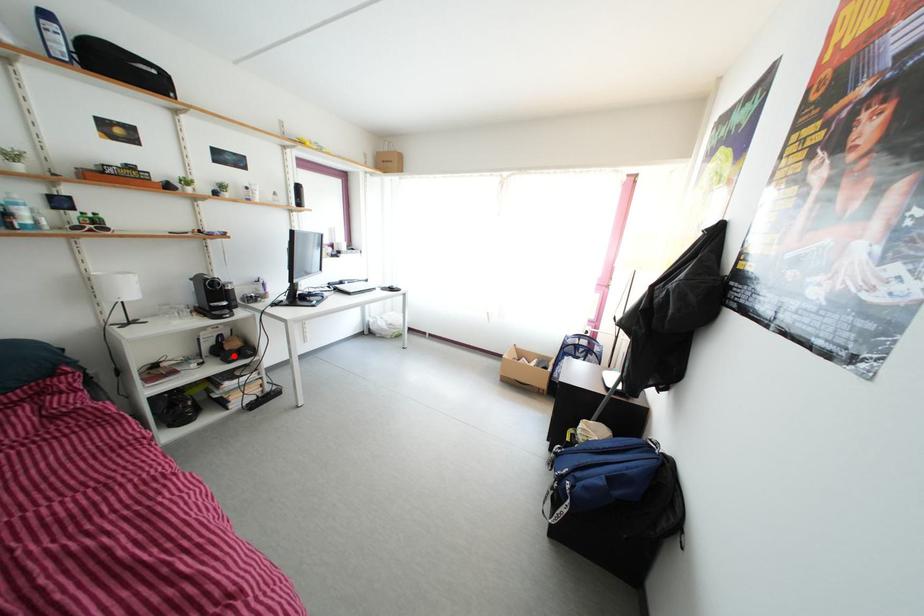
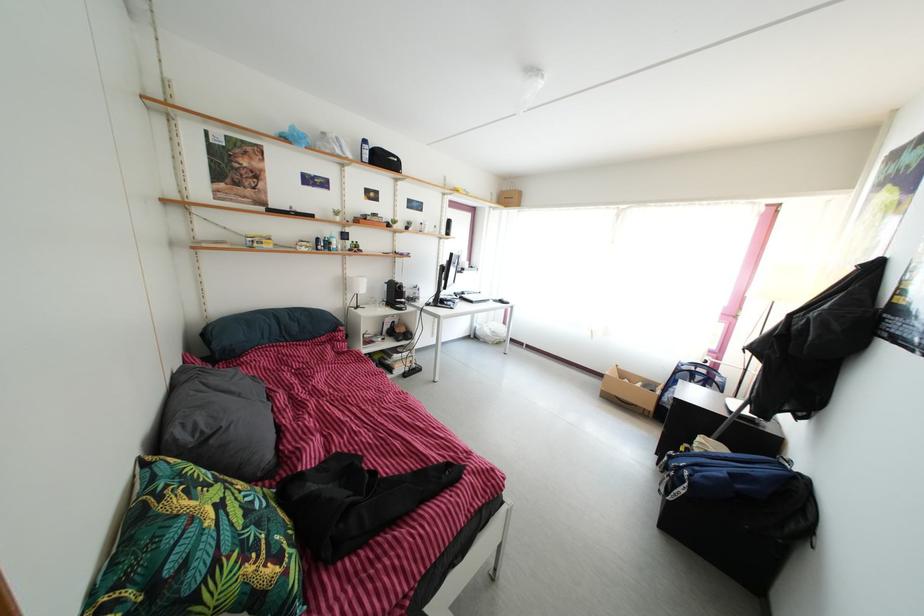
Question: I am providing you with two images of the same scene from different viewpoints. A red point is shown in image1. For the corresponding object point in image2, is it positioned nearer or farther from the camera?

Choices:
 (A) Nearer
 (B) Farther

Answer: (B)